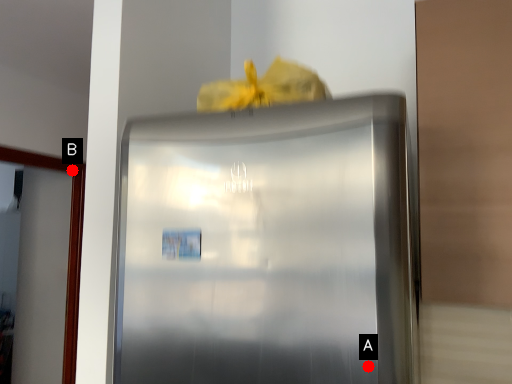
Question: Two points are circled on the image, labeled by A and B beside each circle. Which of the following is the closest to the observer?

Choices:
 (A) A is closer
 (B) B is closer

Answer: (A)